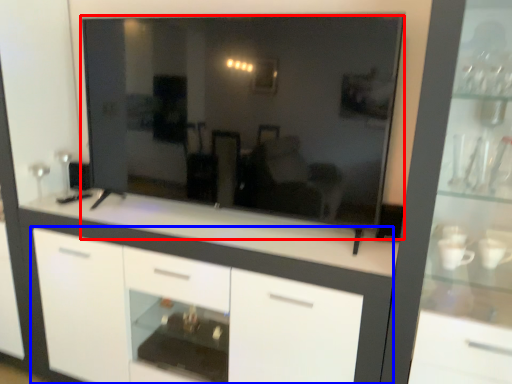
Question: Which object appears closest to the camera in this image, mirror (highlighted by a red box) or cabinetry (highlighted by a blue box)?

Choices:
 (A) mirror
 (B) cabinetry

Answer: (A)